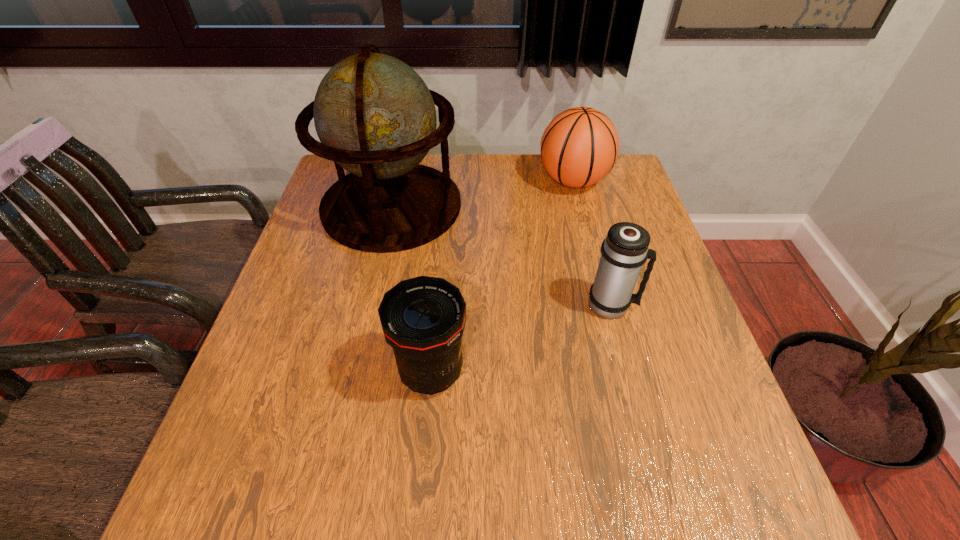
The height and width of the screenshot is (540, 960). I want to click on the tallest object, so click(375, 117).

Where is `basketball`? The width and height of the screenshot is (960, 540). basketball is located at coordinates (579, 147).

Image resolution: width=960 pixels, height=540 pixels. What are the coordinates of `the third farthest object` in the screenshot? It's located at (625, 249).

Locate an element on the screen. Image resolution: width=960 pixels, height=540 pixels. the nearest object is located at coordinates (423, 318).

Locate an element on the screen. Image resolution: width=960 pixels, height=540 pixels. vacant point located 0.140m on the front-facing side of the tallest object is located at coordinates (372, 295).

Locate an element on the screen. vacant space located on the left of the basketball is located at coordinates (458, 180).

The image size is (960, 540). Identify the location of vacant region located on the front of the telephoto lens. (419, 510).

You are a GUI agent. You are given a task and a screenshot of the screen. Output one action in this format:
    pyautogui.click(x=<x>, y=<y>)
    Task: Click on the globe situated at the far edge
    The width and height of the screenshot is (960, 540).
    Given the screenshot: What is the action you would take?
    pyautogui.click(x=375, y=117)

I want to click on basketball that is at the far edge, so click(579, 147).

This screenshot has width=960, height=540. Find the location of `object at the left edge`. object at the left edge is located at coordinates (375, 117).